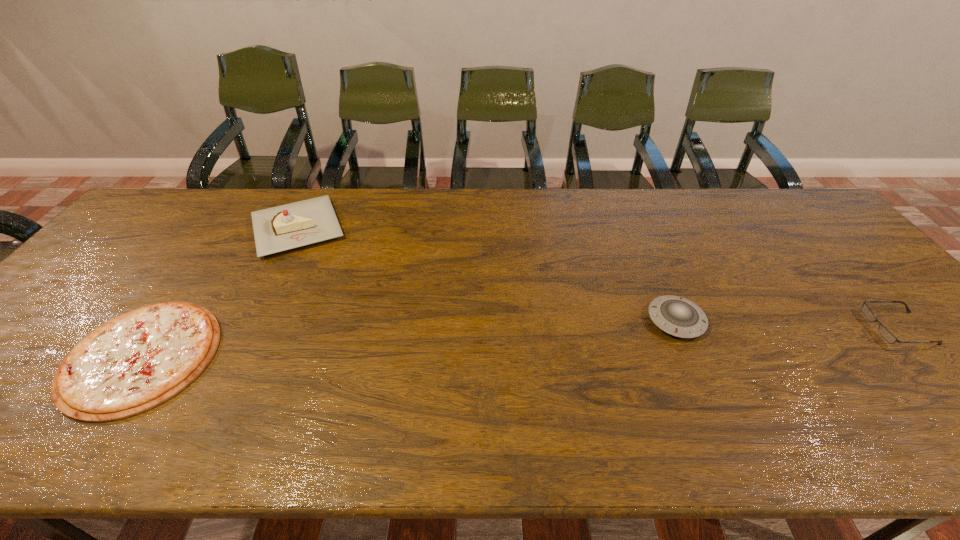
Locate an element on the screen. free area in between the pizza and the third shortest object is located at coordinates (x=409, y=338).

You are a GUI agent. You are given a task and a screenshot of the screen. Output one action in this format:
    pyautogui.click(x=<x>, y=<y>)
    Task: Click on the free spot between the third object from left to right and the farthest object
    
    Given the screenshot: What is the action you would take?
    pyautogui.click(x=487, y=274)

This screenshot has height=540, width=960. I want to click on vacant space that's between the saucer and the rightmost object, so click(x=787, y=325).

The width and height of the screenshot is (960, 540). Identify the location of vacant space that is in between the cake and the shortest object. (220, 292).

Identify the location of object that can be found as the third closest to the second shortest object. (136, 361).

The width and height of the screenshot is (960, 540). Find the location of `object that is the closest one to the spectacles`. object that is the closest one to the spectacles is located at coordinates (677, 316).

Find the location of a particular element. This screenshot has width=960, height=540. free spot that satisfies the following two spatial constraints: 1. on the back side of the second object from right to left; 2. on the right side of the shortest object is located at coordinates (166, 320).

Where is `vacant region that satisfies the following two spatial constraints: 1. on the front side of the tallest object; 2. on the right side of the third object from left to right`? vacant region that satisfies the following two spatial constraints: 1. on the front side of the tallest object; 2. on the right side of the third object from left to right is located at coordinates (251, 320).

In order to click on blank space that satisfies the following two spatial constraints: 1. on the front side of the tallest object; 2. on the right side of the third shortest object in this screenshot , I will do `click(251, 320)`.